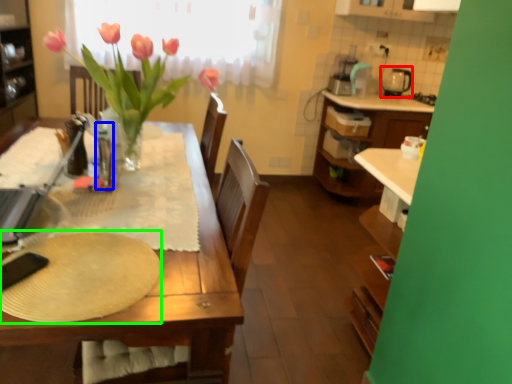
Question: Which object is positioned farthest from appliance (highlighted by a red box)? Select from bottle (highlighted by a blue box) and paper plate (highlighted by a green box).

Choices:
 (A) bottle
 (B) paper plate

Answer: (B)